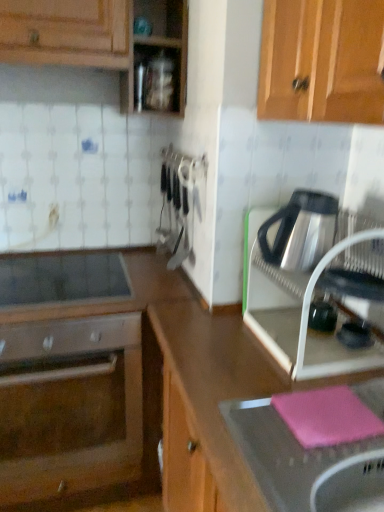
Find the location of a particular element. free space above pink rubber mat at lower right (from a real-world perspective) is located at coordinates (320, 431).